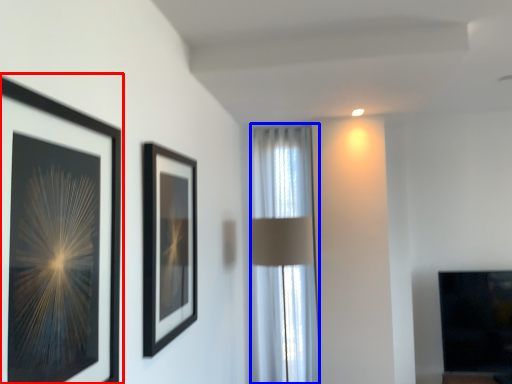
Question: Which point is further to the camera, picture frame (highlighted by a red box) or curtain (highlighted by a blue box)?

Choices:
 (A) picture frame
 (B) curtain

Answer: (B)